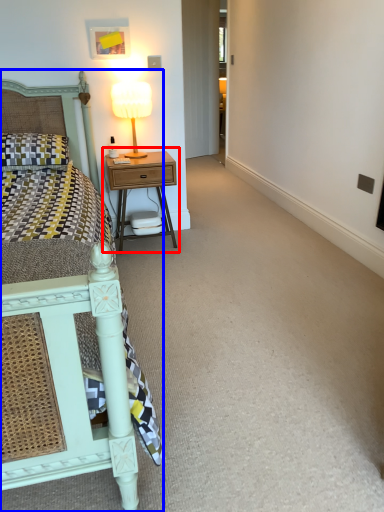
Question: Among these objects, which one is nearest to the camera, nightstand (highlighted by a red box) or bed (highlighted by a blue box)?

Choices:
 (A) nightstand
 (B) bed

Answer: (B)